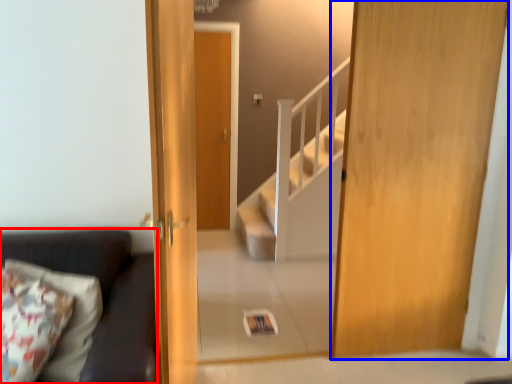
Question: Which object is closer to the camera taking this photo, studio couch (highlighted by a red box) or door (highlighted by a blue box)?

Choices:
 (A) studio couch
 (B) door

Answer: (A)